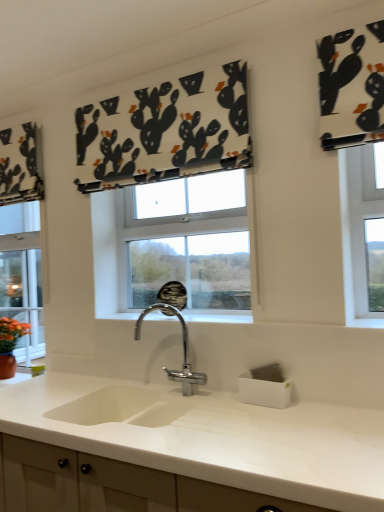
Question: From a real-world perspective, is black printed fabric at upper center below chrome metallic faucet at center?

Choices:
 (A) no
 (B) yes

Answer: (A)

Question: Is black printed fabric at upper center behind chrome metallic faucet at center?

Choices:
 (A) no
 (B) yes

Answer: (B)

Question: Is black printed fabric at upper center at the right side of chrome metallic faucet at center?

Choices:
 (A) yes
 (B) no

Answer: (B)

Question: Is black printed fabric at upper center to the left of chrome metallic faucet at center from the viewer's perspective?

Choices:
 (A) no
 (B) yes

Answer: (B)

Question: Is chrome metallic faucet at center a part of black printed fabric at upper center?

Choices:
 (A) no
 (B) yes

Answer: (A)

Question: Are black printed fabric at upper center and chrome metallic faucet at center far apart?

Choices:
 (A) no
 (B) yes

Answer: (A)

Question: Considering the relative sizes of white matte countertop at center and chrome metallic faucet at center in the image provided, is white matte countertop at center shorter than chrome metallic faucet at center?

Choices:
 (A) no
 (B) yes

Answer: (A)

Question: Can you confirm if white matte countertop at center is positioned to the left of chrome metallic faucet at center?

Choices:
 (A) yes
 (B) no

Answer: (A)

Question: From a real-world perspective, is white matte countertop at center over chrome metallic faucet at center?

Choices:
 (A) no
 (B) yes

Answer: (A)

Question: From a real-world perspective, is white matte countertop at center located beneath chrome metallic faucet at center?

Choices:
 (A) no
 (B) yes

Answer: (B)

Question: Considering the relative sizes of white matte countertop at center and chrome metallic faucet at center in the image provided, is white matte countertop at center wider than chrome metallic faucet at center?

Choices:
 (A) yes
 (B) no

Answer: (A)

Question: Is white matte countertop at center aimed at chrome metallic faucet at center?

Choices:
 (A) no
 (B) yes

Answer: (A)

Question: From the image's perspective, is white matte countertop at center located beneath black printed fabric at upper center?

Choices:
 (A) yes
 (B) no

Answer: (A)